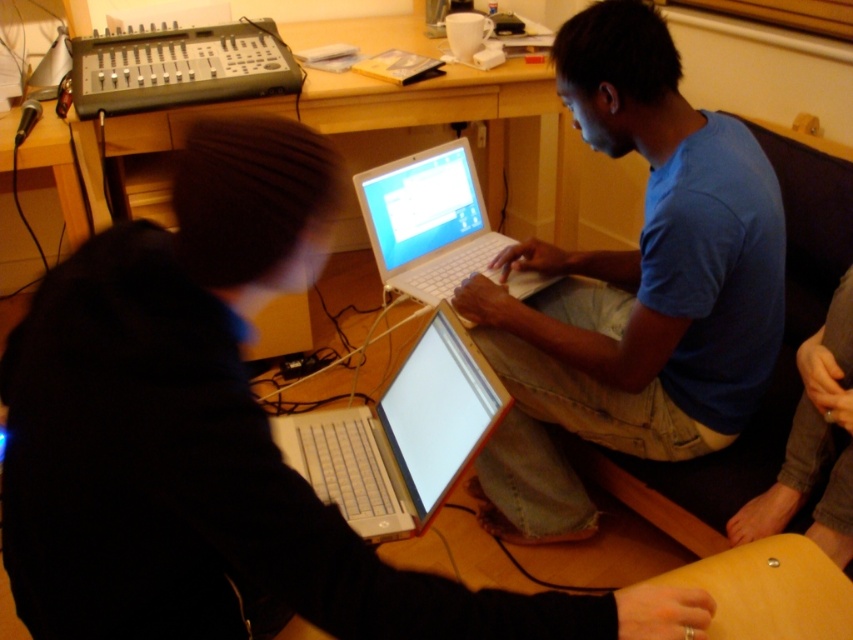
Is blue cotton shirt at upper right to the left of dark gray fabric pants at lower right from the viewer's perspective?

Correct, you'll find blue cotton shirt at upper right to the left of dark gray fabric pants at lower right.

Can you confirm if blue cotton shirt at upper right is positioned below dark gray fabric pants at lower right?

Incorrect, blue cotton shirt at upper right is not positioned below dark gray fabric pants at lower right.

At what (x,y) coordinates should I click in order to perform the action: click on blue cotton shirt at upper right. Please return your answer as a coordinate pair (x, y). Image resolution: width=853 pixels, height=640 pixels. Looking at the image, I should click on coord(633,289).

Locate an element on the screen. blue cotton shirt at upper right is located at coordinates (633, 289).

Which is below, blue cotton shirt at upper right or black plastic audio mixer at upper left?

blue cotton shirt at upper right is lower down.

Does blue cotton shirt at upper right have a lesser width compared to black plastic audio mixer at upper left?

No.

Which is in front, point (711, 333) or point (167, 96)?

Point (711, 333) is in front.

In order to click on blue cotton shirt at upper right in this screenshot , I will do `click(633, 289)`.

Is the position of white plastic laptop at center more distant than that of dark gray fabric pants at lower right?

Yes, it is behind dark gray fabric pants at lower right.

At what (x,y) coordinates should I click in order to perform the action: click on white plastic laptop at center. Please return your answer as a coordinate pair (x, y). The height and width of the screenshot is (640, 853). Looking at the image, I should click on (428, 221).

Identify the location of white plastic laptop at center. The image size is (853, 640). (428, 221).